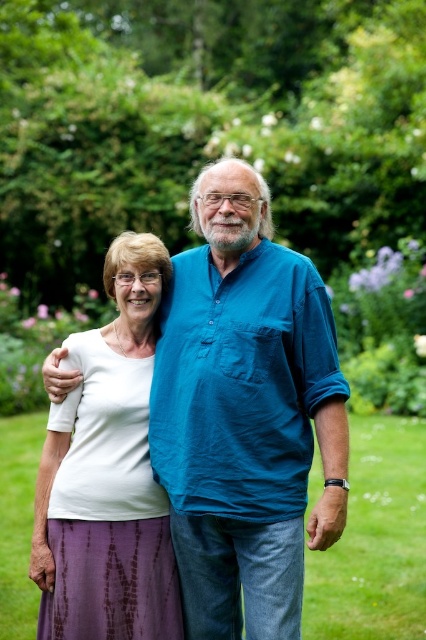
You are a photographer trying to capture a photo of two people in a garden. You notice the white cotton shirt at center and the white matte shirt at center. Which shirt should you focus on if you want to capture the person on the right side of the image?

The white cotton shirt at center is to the right of the white matte shirt at center, so focusing on the white cotton shirt at center will capture the person on the right side of the image.

You are trying to decide which shirt to wear for a casual day out. Both the white cotton shirt at center and the white matte shirt at center are options. Based on their sizes, which one would be more comfortable for layering under a jacket?

The white cotton shirt at center is larger in size compared to the white matte shirt at center, so it would be more comfortable for layering under a jacket.

You are standing at the point with coordinates point [245,413] and want to move towards the teal button shirt on the right. Is the teal button shirt on the right located to your left or right side?

The teal button shirt on the right is located to your right side since you are at point [245,413] where the white cotton shirt at center is situated, and the teal button shirt on the right is positioned to the right of that point.